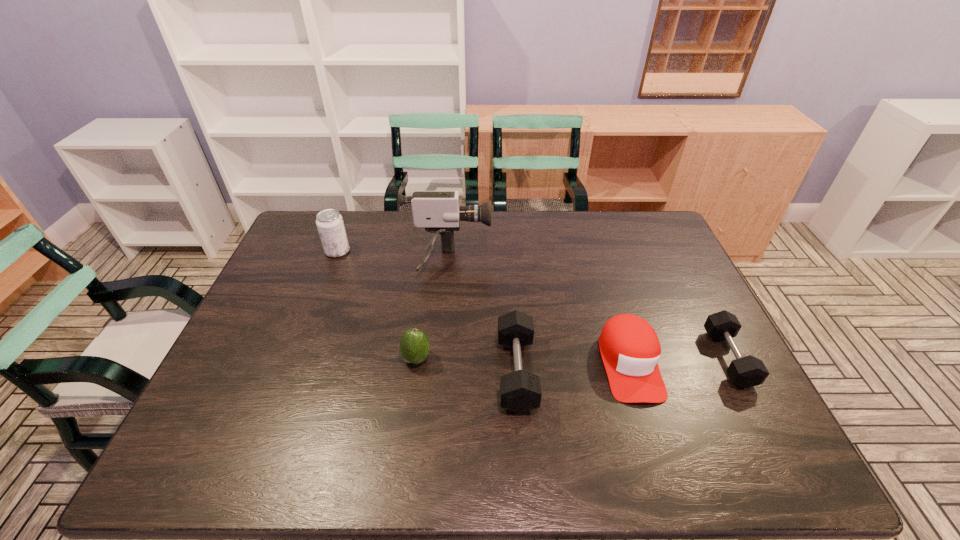
Please point a spot to add another dumbbell on the left. Please provide its 2D coordinates. Your answer should be formatted as a tuple, i.e. [(x, y)], where the tuple contains the x and y coordinates of a point satisfying the conditions above.

[(292, 387)]